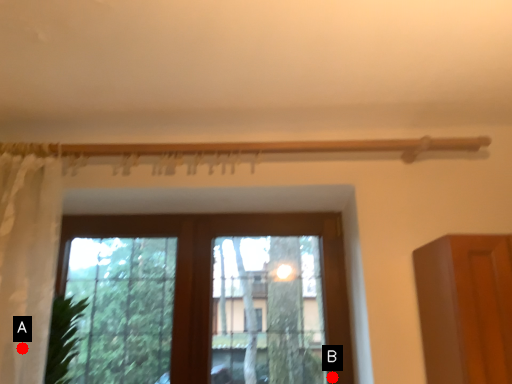
Question: Two points are circled on the image, labeled by A and B beside each circle. Which point is farther from the camera taking this photo?

Choices:
 (A) A is further
 (B) B is further

Answer: (B)